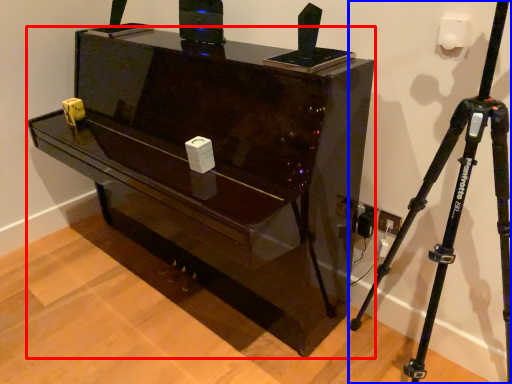
Question: Which object is further to the camera taking this photo, furniture (highlighted by a red box) or tripod (highlighted by a blue box)?

Choices:
 (A) furniture
 (B) tripod

Answer: (A)